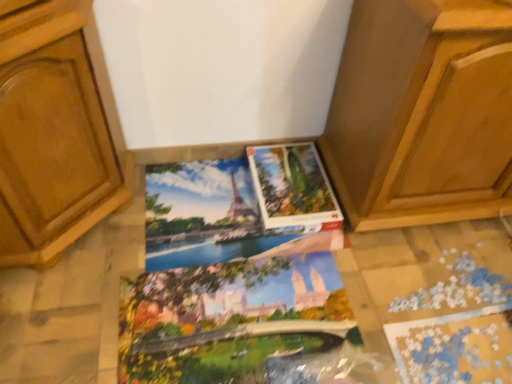
Locate an element on the screen. The width and height of the screenshot is (512, 384). free space between wooden cabinet at center and matte paper coloring book at center, marked as the first coloring book in a bottom-to-top arrangement is located at coordinates (365, 268).